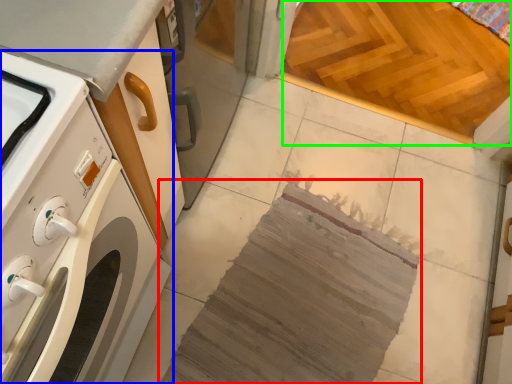
Question: Estimate the real-world distances between objects in this image. Which object is farther from blanket (highlighted by a red box), home appliance (highlighted by a blue box) or plywood (highlighted by a green box)?

Choices:
 (A) home appliance
 (B) plywood

Answer: (B)